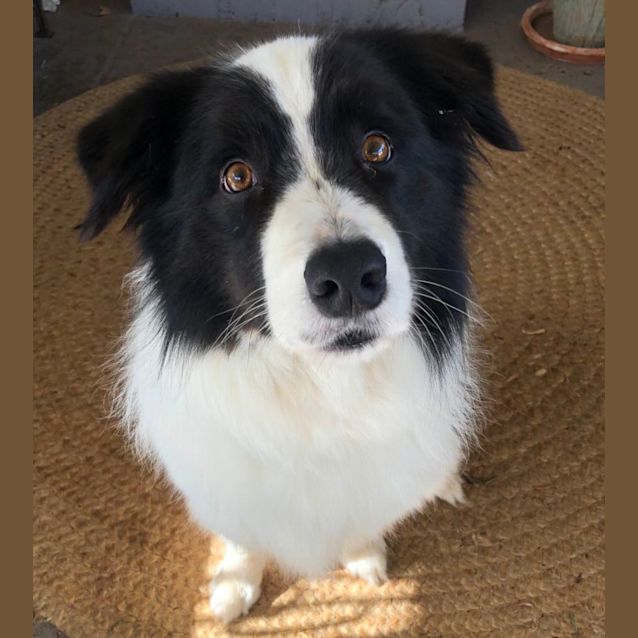
The height and width of the screenshot is (638, 638). What are the coordinates of `white chest` in the screenshot? It's located at (325, 460).